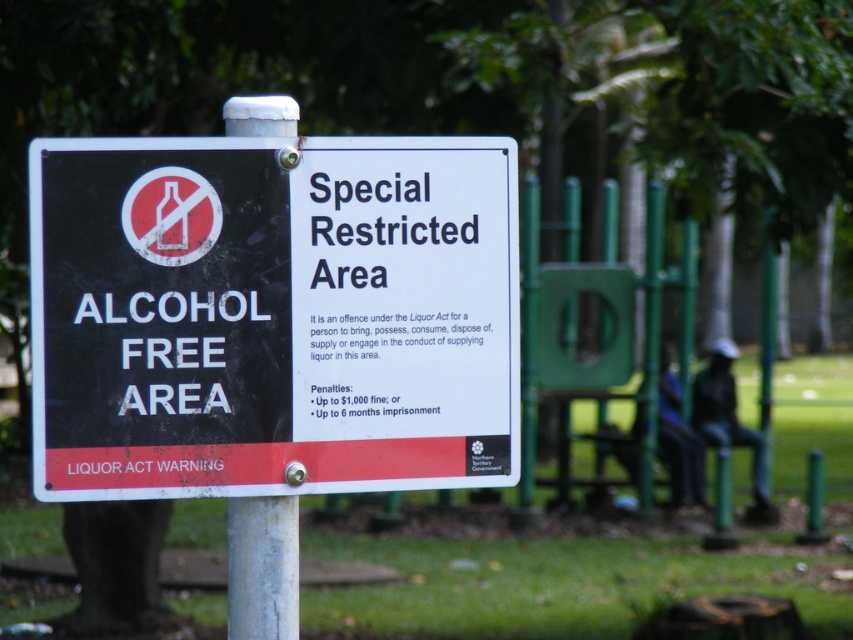
Question: Which point is farther to the camera?

Choices:
 (A) white metallic pole at center
 (B) metallic signboard at center

Answer: (A)

Question: Can you confirm if metallic signboard at center is positioned to the right of white metallic pole at center?

Choices:
 (A) yes
 (B) no

Answer: (A)

Question: Observing the image, what is the correct spatial positioning of metallic signboard at center in reference to white metallic pole at center?

Choices:
 (A) below
 (B) above

Answer: (B)

Question: Is metallic signboard at center above white metallic pole at center?

Choices:
 (A) yes
 (B) no

Answer: (A)

Question: Among these points, which one is nearest to the camera?

Choices:
 (A) tap(292, 118)
 (B) tap(271, 198)

Answer: (B)